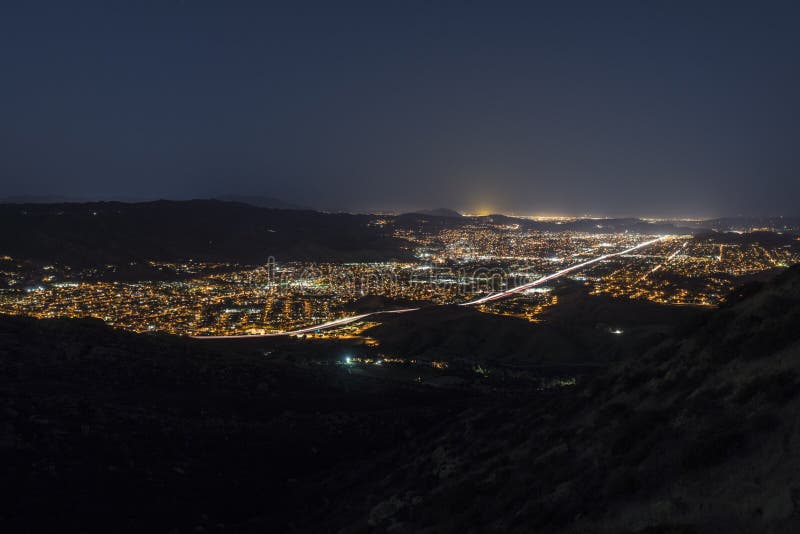
Identify the location of night lights. This screenshot has width=800, height=534. (542, 280).